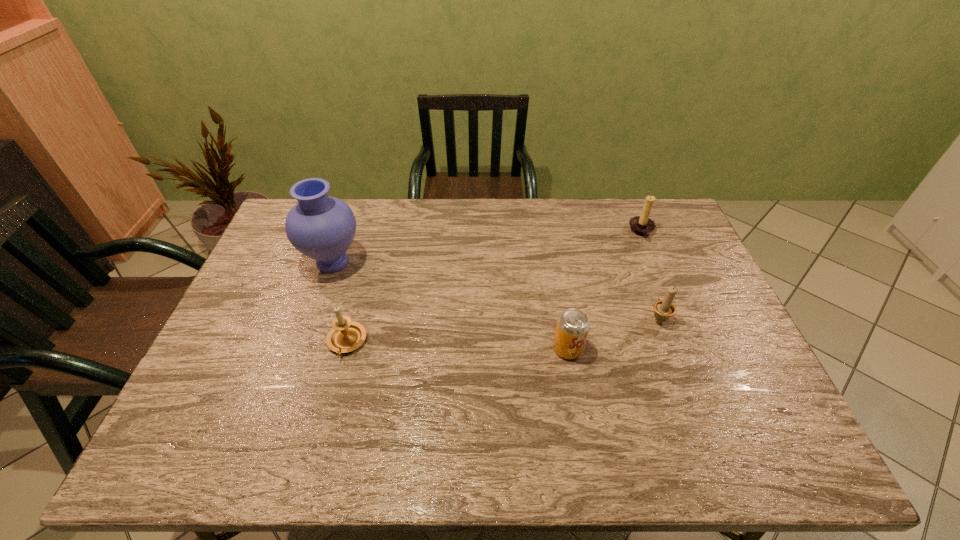
In order to click on vacant space that satisfies the following two spatial constraints: 1. on the wick of the farthest candle holder; 2. with a handle on the side of the leftmost candle holder in this screenshot , I will do (686, 342).

Locate an element on the screen. free spot that satisfies the following two spatial constraints: 1. with a handle on the side of the pop (soda); 2. on the left side of the leftmost candle holder is located at coordinates (345, 349).

I want to click on vacant position in the image that satisfies the following two spatial constraints: 1. on the wick of the farthest candle holder; 2. with a handle on the side of the leftmost candle holder, so click(686, 342).